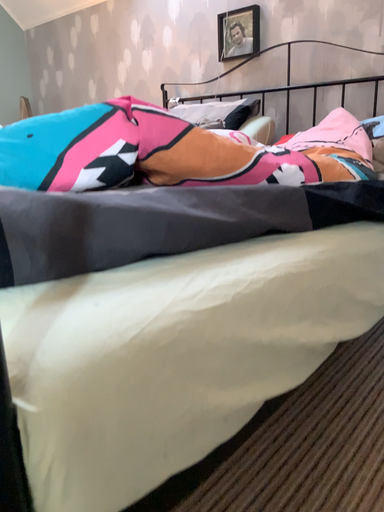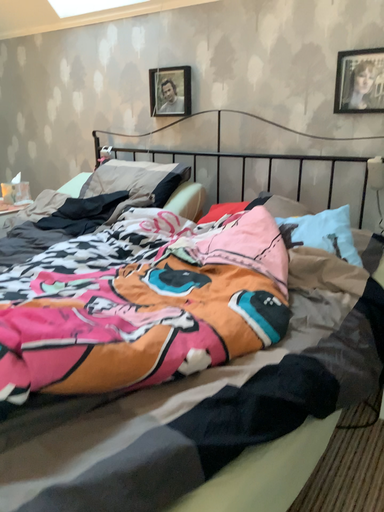
Question: Which way did the camera rotate in the video?

Choices:
 (A) rotated right
 (B) rotated left

Answer: (A)